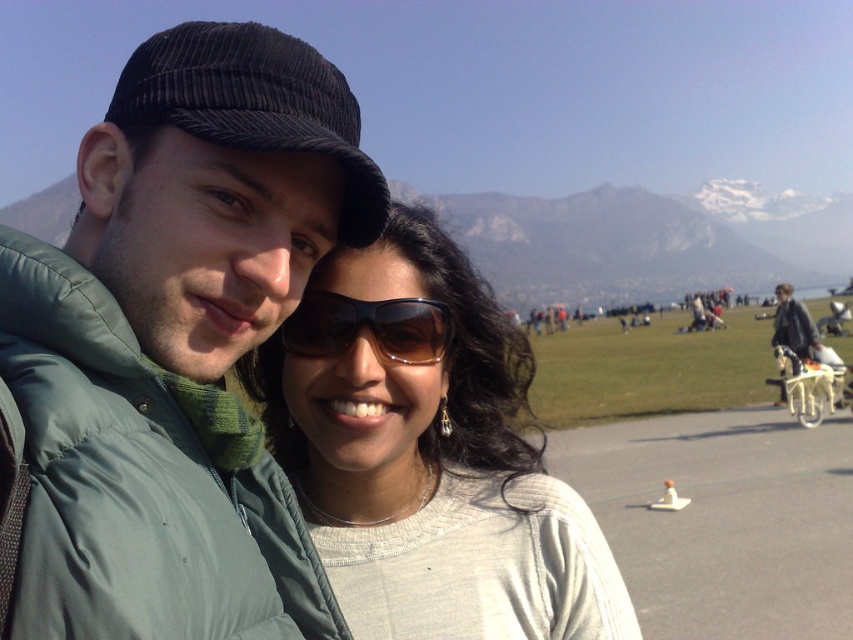
You are a photographer trying to capture a group photo of two people wearing the green puffy jacket at center and the matte white sweater at center. Since you want to ensure proper framing, which person should you position closer to the front to avoid their head blocking the other person?

The matte white sweater at center should be positioned closer to the front because the green puffy jacket at center is much taller, so placing the shorter person in front prevents their head from being blocked by the taller person.

Consider the image. You are a photographer trying to capture a group photo of two friends wearing the green puffy jacket at center and the matte white sweater at center. Since you want both of them to appear equally sized in the photo, which friend should move closer to the camera?

The person wearing the matte white sweater at center should move closer to the camera because the green puffy jacket at center is already larger in size, so moving the smaller one closer will help balance their sizes in the photo.